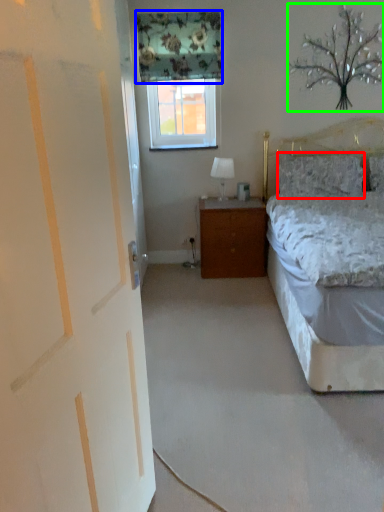
Question: Which object is the farthest from pillow (highlighted by a red box)? Choose among these: curtain (highlighted by a blue box) or tree (highlighted by a green box).

Choices:
 (A) curtain
 (B) tree

Answer: (A)